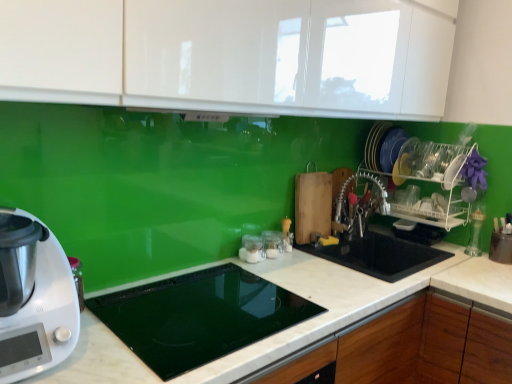
This screenshot has height=384, width=512. What do you see at coordinates (34, 298) in the screenshot?
I see `white plastic food processor at lower left` at bounding box center [34, 298].

The width and height of the screenshot is (512, 384). Find the location of `white plastic food processor at lower left`. white plastic food processor at lower left is located at coordinates (34, 298).

The height and width of the screenshot is (384, 512). What are the coordinates of `white marble countertop at center` in the screenshot? It's located at (342, 300).

What are the coordinates of `clear glass jars at center, which is the third appliance from front to back` in the screenshot? It's located at (272, 243).

The width and height of the screenshot is (512, 384). Describe the element at coordinates (209, 54) in the screenshot. I see `white glossy cabinet at upper center` at that location.

Identify the location of clear glass jar at center, the 2th appliance in the front-to-back sequence. This screenshot has height=384, width=512. (252, 249).

Is white plastic food processor at lower left touching white marble countertop at center?

white plastic food processor at lower left is not next to white marble countertop at center, and they're not touching.

Is white plastic food processor at lower left at the left side of white marble countertop at center?

Indeed, white plastic food processor at lower left is positioned on the left side of white marble countertop at center.

Between point (6, 333) and point (185, 381), which one is positioned behind?

The point (185, 381) is farther from the camera.

Can you confirm if white plastic food processor at lower left is wider than white marble countertop at center?

No.

Does satin nickel faucet at center right lie behind clear glass jars at center, which is the third appliance from front to back?

Yes, it is.

Who is shorter, satin nickel faucet at center right or clear glass jars at center, which is the 1th appliance from back to front?

Standing shorter between the two is clear glass jars at center, which is the 1th appliance from back to front.

Considering the relative sizes of satin nickel faucet at center right and clear glass jars at center, which is the third appliance from front to back, in the image provided, is satin nickel faucet at center right bigger than clear glass jars at center, which is the third appliance from front to back,?

Yes, satin nickel faucet at center right is bigger than clear glass jars at center, which is the third appliance from front to back.

How distant is satin nickel faucet at center right from clear glass jars at center, which is the 1th appliance from back to front?

satin nickel faucet at center right is 17.84 inches from clear glass jars at center, which is the 1th appliance from back to front.

What's the angular difference between white marble countertop at center and white glossy cabinet at upper center's facing directions?

The angular difference between white marble countertop at center and white glossy cabinet at upper center is 0.565 degrees.

From the image's perspective, would you say white marble countertop at center is shown under white glossy cabinet at upper center?

Yes, from the image's perspective, white marble countertop at center is below white glossy cabinet at upper center.

Would you say white marble countertop at center is to the left or to the right of white glossy cabinet at upper center in the picture?

Based on their positions, white marble countertop at center is located to the right of white glossy cabinet at upper center.

Considering the sizes of white marble countertop at center and white glossy cabinet at upper center in the image, is white marble countertop at center wider or thinner than white glossy cabinet at upper center?

white marble countertop at center is wider than white glossy cabinet at upper center.

In the scene shown: From the image's perspective, who appears lower, clear glass jars at center, which is the third appliance from front to back, or white plastic food processor at lower left?

From the image's view, clear glass jars at center, which is the third appliance from front to back, is below.

Would you say white plastic food processor at lower left is part of clear glass jars at center, which is the 1th appliance from back to front,'s contents?

That's incorrect, white plastic food processor at lower left is not inside clear glass jars at center, which is the 1th appliance from back to front.

Which of these two, clear glass jars at center, which is the third appliance from front to back, or white plastic food processor at lower left, stands taller?

white plastic food processor at lower left.

How different are the orientations of white plastic food processor at lower left and clear glass jar at center, the 2th appliance in the front-to-back sequence, in degrees?

white plastic food processor at lower left and clear glass jar at center, the 2th appliance in the front-to-back sequence, are facing 0.000607 degrees away from each other.

From a real-world perspective, is white plastic food processor at lower left located higher than clear glass jar at center, the 2th appliance in the front-to-back sequence?

Indeed, from a real-world perspective, white plastic food processor at lower left stands above clear glass jar at center, the 2th appliance in the front-to-back sequence.

Can you confirm if white plastic food processor at lower left is smaller than clear glass jar at center, the 2th appliance in the front-to-back sequence?

Incorrect, white plastic food processor at lower left is not smaller in size than clear glass jar at center, the 2th appliance in the front-to-back sequence.

Is white plastic food processor at lower left looking in the opposite direction of clear glass jar at center, marked as the 2th appliance in a back-to-front arrangement?

No, white plastic food processor at lower left is not facing away from clear glass jar at center, marked as the 2th appliance in a back-to-front arrangement.

From the image's perspective, is white glossy cabinet at upper center located above satin nickel faucet at center right?

Yes, from the image's perspective, white glossy cabinet at upper center is on top of satin nickel faucet at center right.

Is point (15, 66) behind point (375, 196)?

No, it is in front of (375, 196).

Is white glossy cabinet at upper center looking in the opposite direction of satin nickel faucet at center right?

white glossy cabinet at upper center does not have its back to satin nickel faucet at center right.

From a real-world perspective, which object rests below the other?

In real-world perspective, satin nickel faucet at center right is lower.

Can you confirm if satin nickel faucet at center right is positioned to the left of white marble countertop at center?

Incorrect, satin nickel faucet at center right is not on the left side of white marble countertop at center.

Which object is further away from the camera, satin nickel faucet at center right or white marble countertop at center?

satin nickel faucet at center right is more distant.

Is satin nickel faucet at center right smaller than white marble countertop at center?

Correct, satin nickel faucet at center right occupies less space than white marble countertop at center.

Does point (364, 227) come farther from viewer compared to point (106, 334)?

Yes.

Locate an element on the screen. home appliance above the white marble countertop at center (from a real-world perspective) is located at coordinates (34, 298).

Find the location of `the 1st appliance located beneath the satin nickel faucet at center right (from a real-world perspective)`. the 1st appliance located beneath the satin nickel faucet at center right (from a real-world perspective) is located at coordinates (x=272, y=243).

When comparing their distances from clear glass jar at center, marked as the 2th appliance in a back-to-front arrangement, does satin nickel faucet at center right or clear glass jars at center, which is the 1th appliance from back to front, seem further?

satin nickel faucet at center right lies further to clear glass jar at center, marked as the 2th appliance in a back-to-front arrangement, than the other object.

Looking at the image, which one is located closer to white plastic food processor at lower left, satin nickel faucet at center right or black glass cooktop at center, which appears as the 1th appliance when viewed from the front?

Among the two, black glass cooktop at center, which appears as the 1th appliance when viewed from the front, is located nearer to white plastic food processor at lower left.

From the image, which object appears to be nearer to white glossy cabinet at upper center, clear glass jars at center, which is the 1th appliance from back to front, or white marble countertop at center?

white marble countertop at center is closer to white glossy cabinet at upper center.

Based on the photo, from the image, which object appears to be farther from white plastic food processor at lower left, white glossy cabinet at upper center or satin nickel faucet at center right?

Among the two, satin nickel faucet at center right is located further to white plastic food processor at lower left.

Which object lies further to the anchor point white glossy cabinet at upper center, white marble countertop at center or white plastic food processor at lower left?

white marble countertop at center is positioned further to the anchor white glossy cabinet at upper center.

From the image, which object appears to be farther from satin nickel faucet at center right, white glossy cabinet at upper center or black glass cooktop at center, which appears as the 3th appliance when viewed from the back?

Based on the image, black glass cooktop at center, which appears as the 3th appliance when viewed from the back, appears to be further to satin nickel faucet at center right.

From the image, which object appears to be nearer to black glass cooktop at center, which appears as the 1th appliance when viewed from the front, clear glass jar at center, the 2th appliance in the front-to-back sequence, or satin nickel faucet at center right?

Based on the image, clear glass jar at center, the 2th appliance in the front-to-back sequence, appears to be nearer to black glass cooktop at center, which appears as the 1th appliance when viewed from the front.

From the picture: Estimate the real-world distances between objects in this image. Which object is further from white plastic food processor at lower left, white glossy cabinet at upper center or clear glass jar at center, the 2th appliance in the front-to-back sequence?

clear glass jar at center, the 2th appliance in the front-to-back sequence, is positioned further to the anchor white plastic food processor at lower left.

I want to click on home appliance between white marble countertop at center and clear glass jars at center, which is the 1th appliance from back to front, in the front-back direction, so click(34, 298).

I want to click on home appliance positioned between white marble countertop at center and satin nickel faucet at center right from near to far, so click(x=34, y=298).

You are a GUI agent. You are given a task and a screenshot of the screen. Output one action in this format:
    pyautogui.click(x=<x>, y=<y>)
    Task: Click on the home appliance that lies between white glossy cabinet at upper center and white marble countertop at center from top to bottom
    The height and width of the screenshot is (384, 512).
    Given the screenshot: What is the action you would take?
    pyautogui.click(x=34, y=298)

You are a GUI agent. You are given a task and a screenshot of the screen. Output one action in this format:
    pyautogui.click(x=<x>, y=<y>)
    Task: Click on the appliance situated between clear glass jar at center, the 2th appliance in the front-to-back sequence, and satin nickel faucet at center right from left to right
    Image resolution: width=512 pixels, height=384 pixels.
    Given the screenshot: What is the action you would take?
    pyautogui.click(x=272, y=243)